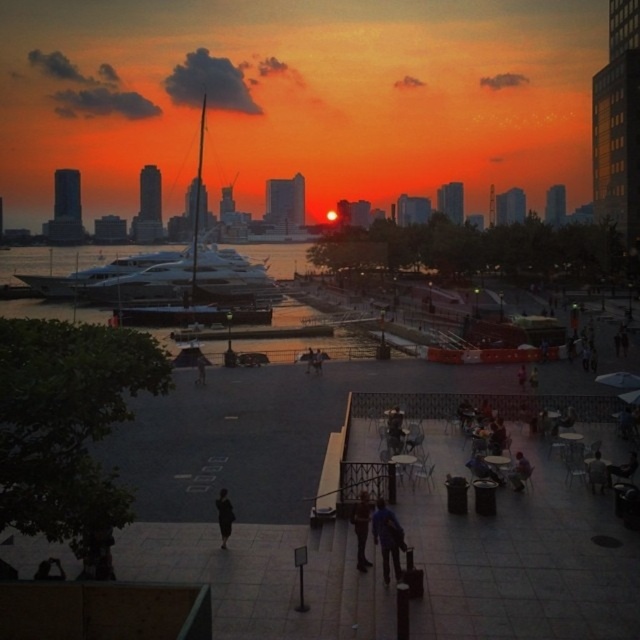
You are standing at the waterfront promenade and want to take a photo of the shiny white yacht at left. Your camera has a maximum zoom range of 50 meters. Can you capture the entire yacht in your photo without moving closer?

The shiny white yacht at left is 55.81 meters away from camera. Since the camera can only zoom up to 50 meters, you cannot capture the entire yacht in your photo without moving closer.

You are standing at the point labeled point (355, 508) and want to walk towards the point labeled point (228, 525). Which direction should you move relative to the waterfront promenade?

You should move backward because point (355, 508) is in front of point (228, 525), meaning it is closer to the viewer. To reach point (228, 525), you need to move away from the viewer towards the marina area.